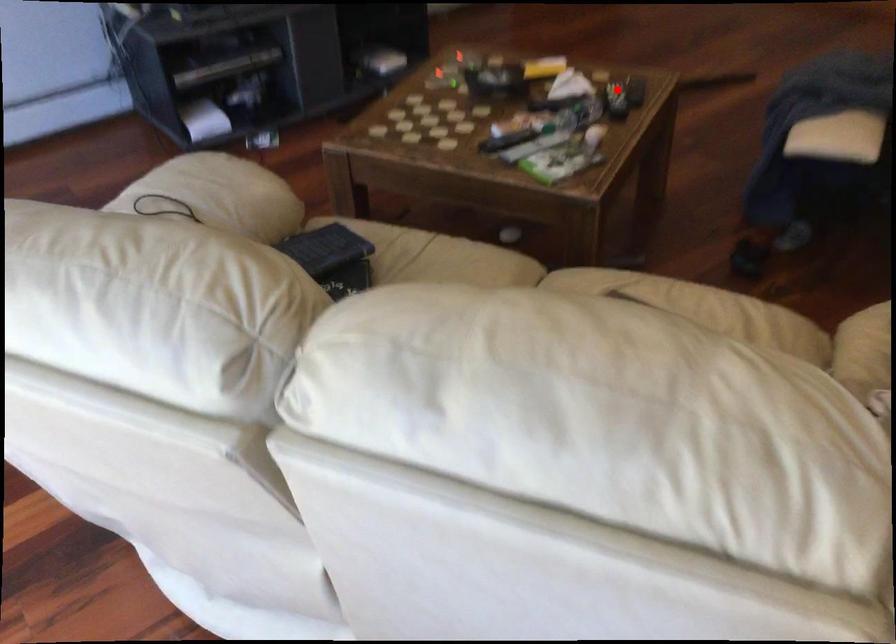
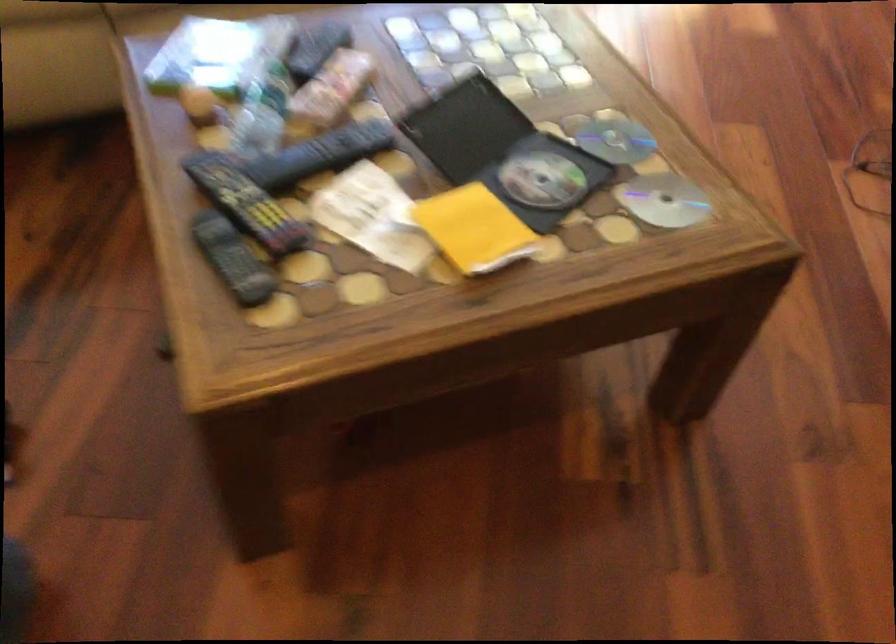
Question: I am providing you with two images of the same scene from different viewpoints. Image1 has a red point marked. In image2, the corresponding 3D location appears at what relative position? Reply with the corresponding letter.

Choices:
 (A) Closer
 (B) Farther

Answer: (A)